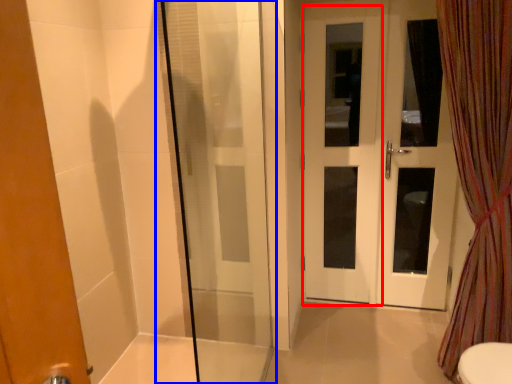
Question: Among these objects, which one is farthest to the camera, screen door (highlighted by a red box) or shower door (highlighted by a blue box)?

Choices:
 (A) screen door
 (B) shower door

Answer: (A)